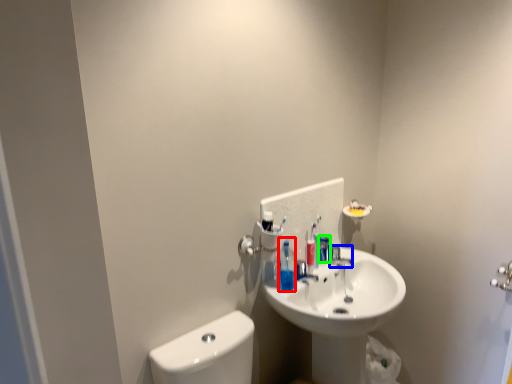
Question: Based on their relative distances, which object is nearer to toiletry (highlighted by a red box)? Choose from plumbing fixture (highlighted by a blue box) and mouthwash (highlighted by a green box).

Choices:
 (A) plumbing fixture
 (B) mouthwash

Answer: (B)